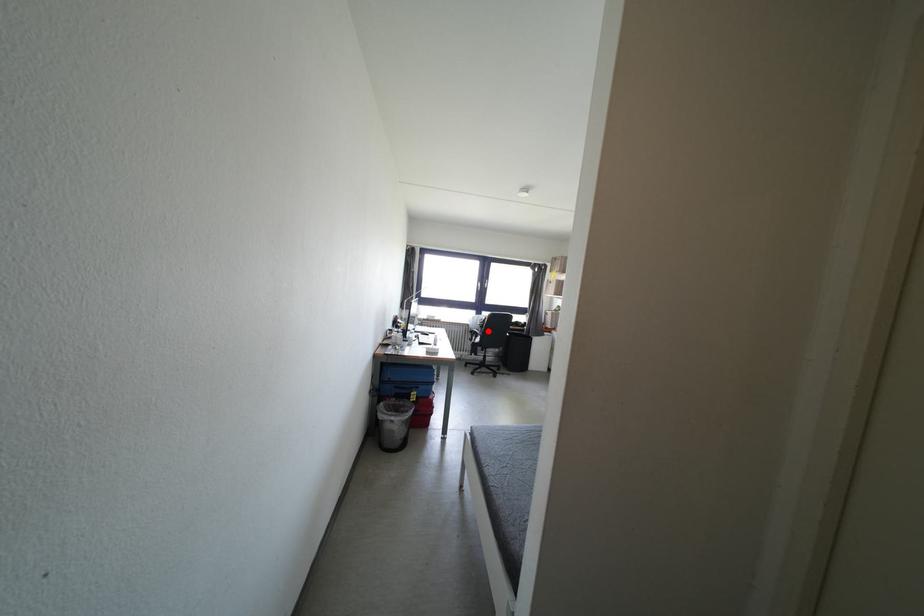
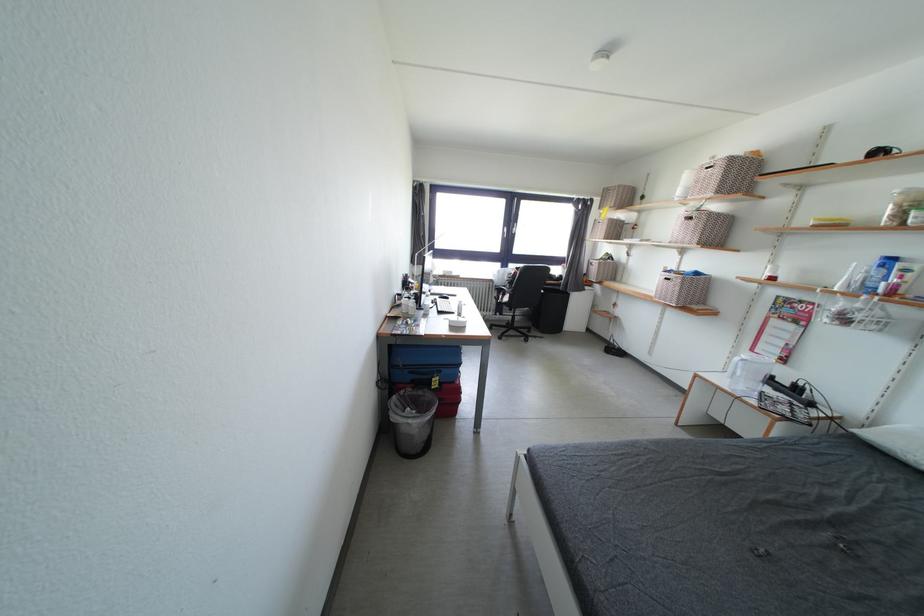
Locate, in the second image, the point that corresponds to the highlighted location in the first image.

(517, 286)